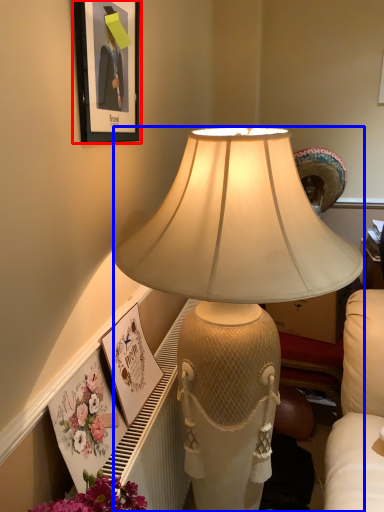
Question: Among these objects, which one is nearest to the camera, picture frame (highlighted by a red box) or lamp (highlighted by a blue box)?

Choices:
 (A) picture frame
 (B) lamp

Answer: (B)